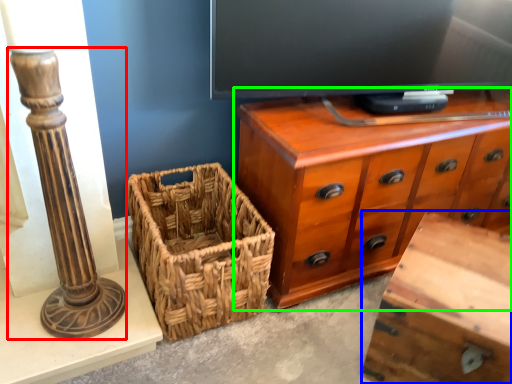
Question: Which object is the closest to the pillar (highlighted by a red box)? Choose among these: vanity (highlighted by a blue box) or chest of drawers (highlighted by a green box).

Choices:
 (A) vanity
 (B) chest of drawers

Answer: (B)